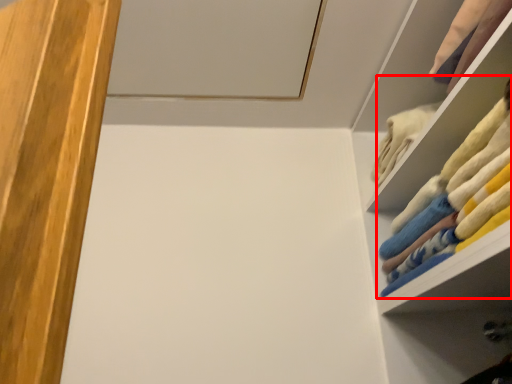
Question: From the image's perspective, what is the correct spatial relationship of laundry (annotated by the red box) in relation to cabinet?

Choices:
 (A) below
 (B) above

Answer: (A)